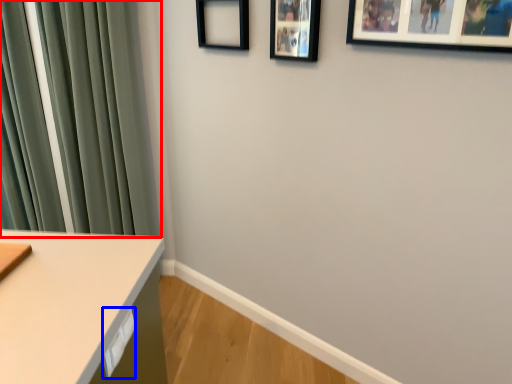
Question: Among these objects, which one is farthest to the camera, curtain (highlighted by a red box) or drawer (highlighted by a blue box)?

Choices:
 (A) curtain
 (B) drawer

Answer: (A)